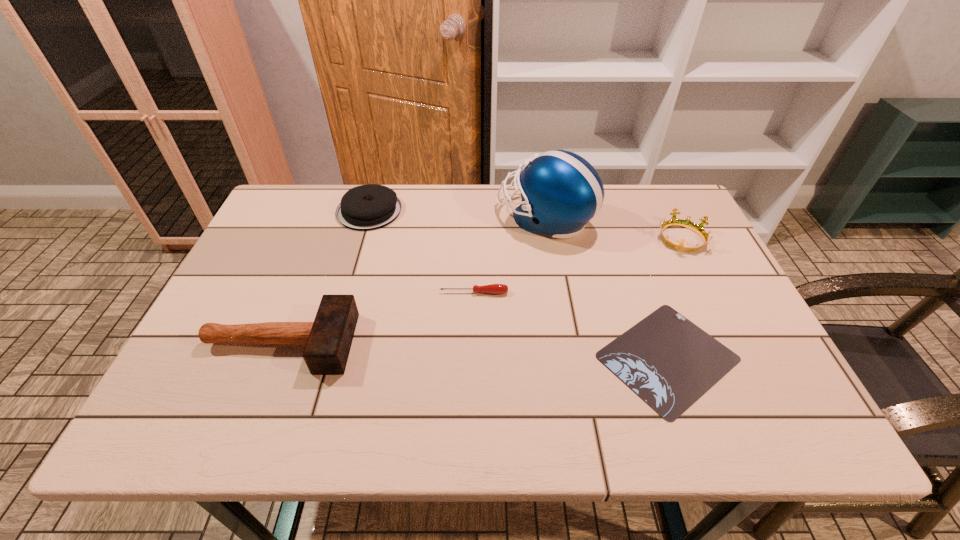
This screenshot has width=960, height=540. In order to click on free space between the fifth tallest object and the pancake in this screenshot , I will do `click(421, 252)`.

Where is `free point between the crown and the fifth tallest object`? The width and height of the screenshot is (960, 540). free point between the crown and the fifth tallest object is located at coordinates (577, 265).

Locate an element on the screen. vacant space that is in between the fifth shortest object and the pancake is located at coordinates [324, 277].

Where is `blank region between the mallet and the second shortest object`? Image resolution: width=960 pixels, height=540 pixels. blank region between the mallet and the second shortest object is located at coordinates (377, 318).

Where is `empty location between the shortest object and the mallet`? empty location between the shortest object and the mallet is located at coordinates (474, 350).

Locate an element on the screen. This screenshot has width=960, height=540. empty space between the pancake and the fourth farthest object is located at coordinates (421, 252).

At what (x,y) coordinates should I click in order to perform the action: click on the fourth closest object to the shortest object. Please return your answer as a coordinate pair (x, y). The width and height of the screenshot is (960, 540). Looking at the image, I should click on (328, 339).

Locate which object is the fifth closest to the mousepad. Please provide its 2D coordinates. Your answer should be formatted as a tuple, i.e. [(x, y)], where the tuple contains the x and y coordinates of a point satisfying the conditions above.

[(367, 207)]

The height and width of the screenshot is (540, 960). Identify the location of free space that satisfies the following two spatial constraints: 1. on the back side of the second shortest object; 2. on the left side of the crown. (474, 238).

I want to click on vacant space that satisfies the following two spatial constraints: 1. on the back side of the crown; 2. on the right side of the mousepad, so click(x=625, y=238).